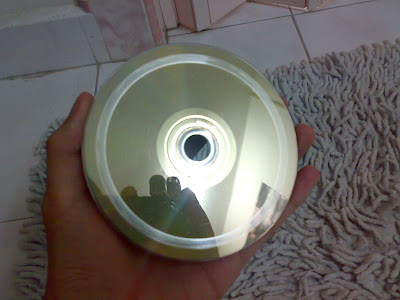
Find the location of a particular element. The width and height of the screenshot is (400, 300). cd is located at coordinates (x=243, y=119).